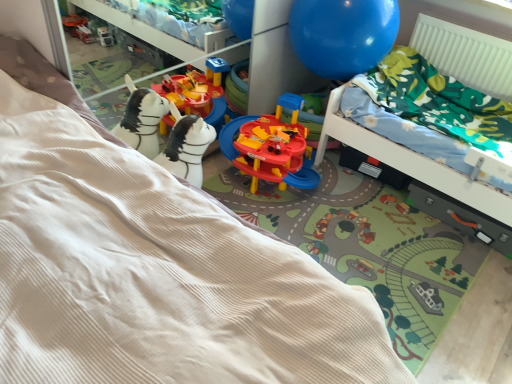
Question: In terms of width, does beige corduroy bed at lower left look wider or thinner when compared to dark gray plastic drawer at lower right?

Choices:
 (A) thin
 (B) wide

Answer: (B)

Question: From the image's perspective, relative to dark gray plastic drawer at lower right, is beige corduroy bed at lower left above or below?

Choices:
 (A) above
 (B) below

Answer: (B)

Question: Which is farther from the blue glossy balloon at upper right?

Choices:
 (A) dark gray plastic drawer at lower right
 (B) white ribbed radiator at upper right
 (C) beige corduroy bed at lower left
 (D) green floral fabric hospital bed at upper right

Answer: (C)

Question: Considering the real-world distances, which object is closest to the green floral fabric hospital bed at upper right?

Choices:
 (A) dark gray plastic drawer at lower right
 (B) beige corduroy bed at lower left
 (C) blue glossy balloon at upper right
 (D) white ribbed radiator at upper right

Answer: (A)